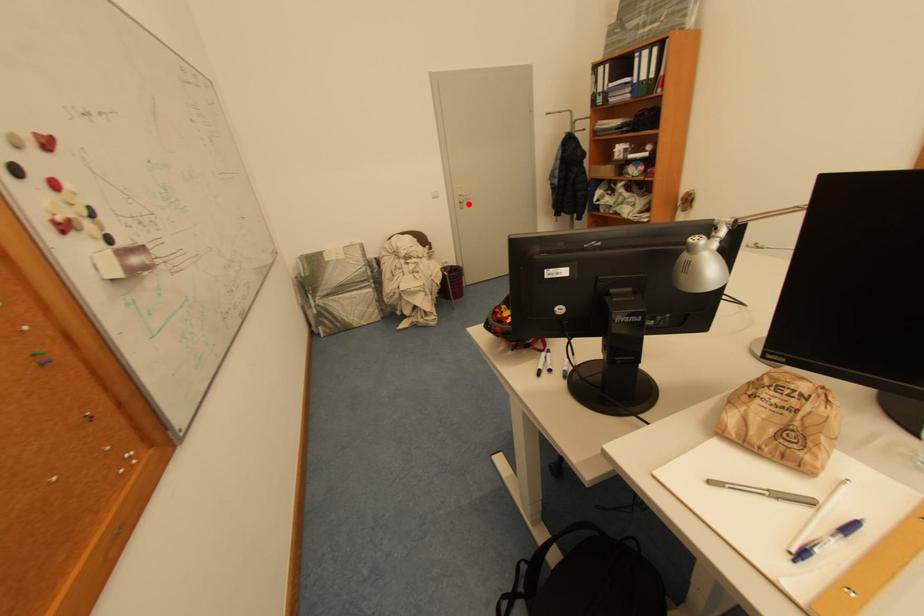
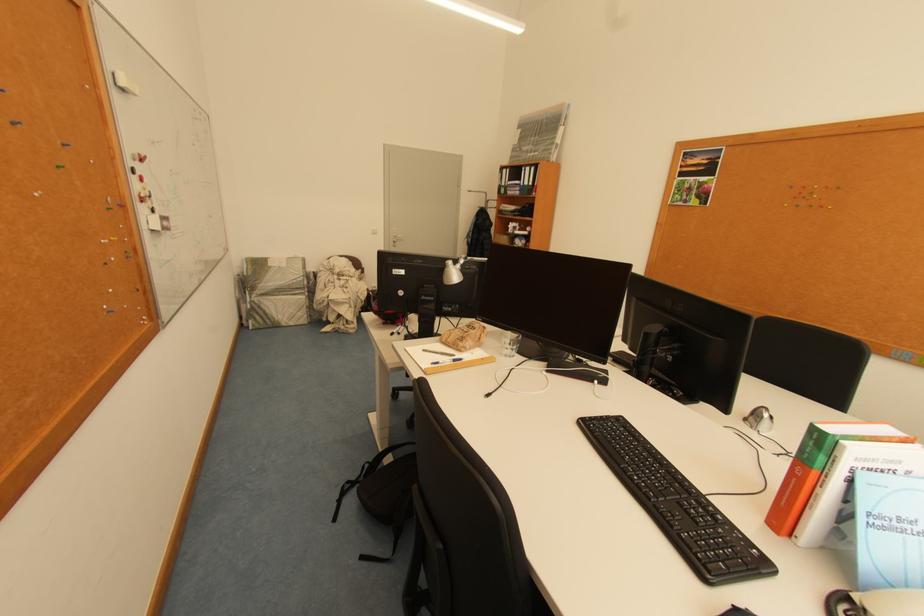
Question: I am providing you with two images of the same scene from different viewpoints. Given a red point in image1, look at the same physical point in image2. Is it:

Choices:
 (A) Closer to the viewpoint
 (B) Farther from the viewpoint

Answer: (B)